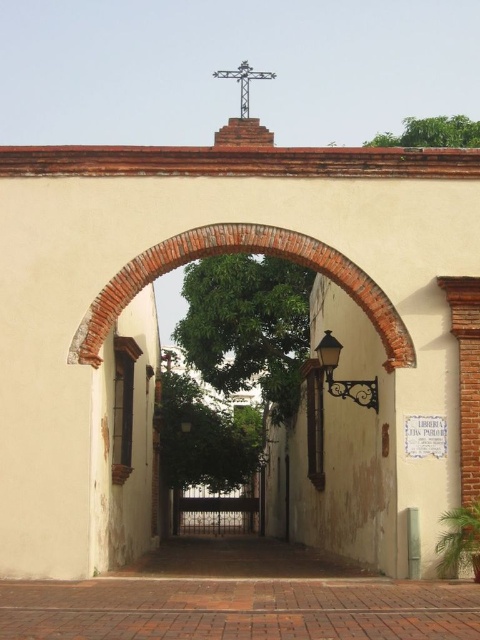
Question: In this image, where is brick at lower center located relative to matte black lamp at center?

Choices:
 (A) right
 (B) left

Answer: (B)

Question: Is brick at lower center above brick archway at center?

Choices:
 (A) yes
 (B) no

Answer: (B)

Question: In this image, where is brick at lower center located relative to matte black lamp at center?

Choices:
 (A) above
 (B) below

Answer: (B)

Question: Which of the following is the closest to the observer?

Choices:
 (A) (110, 310)
 (B) (80, 627)

Answer: (B)

Question: Estimate the real-world distances between objects in this image. Which object is farther from the brick archway at center?

Choices:
 (A) brick at lower center
 (B) matte black lamp at center

Answer: (A)

Question: Estimate the real-world distances between objects in this image. Which object is farther from the brick archway at center?

Choices:
 (A) brick at lower center
 (B) matte black lamp at center

Answer: (A)